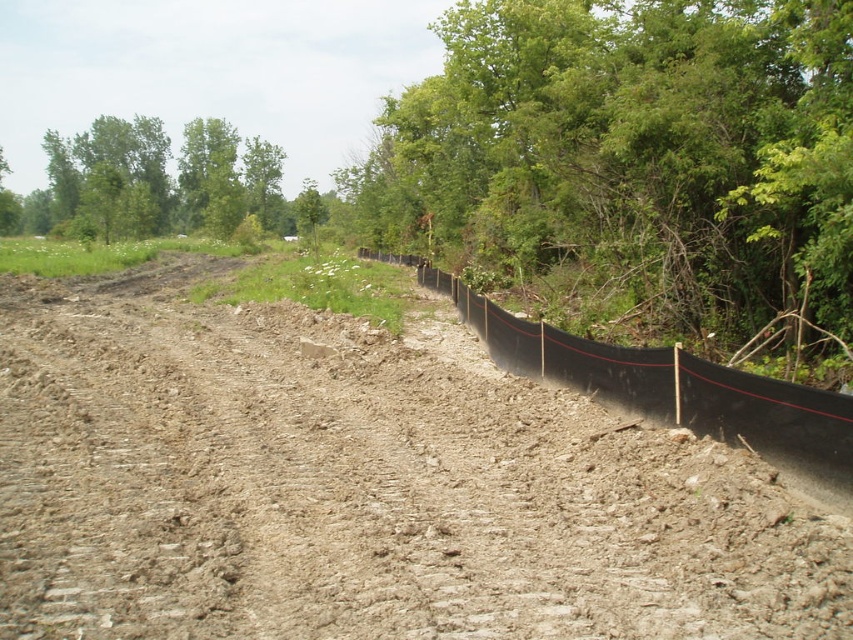
You are a construction worker assessing the site. You notice the brown soil at center and the green leafy tree at right. Which object is positioned lower in the scene?

The brown soil at center is located below the green leafy tree at right, so it is positioned lower in the scene.

You are a construction worker tasked with placing a new piece of equipment in the area shown. The equipment requires a space larger than the black plastic fence at right. Based on the scene, can the brown soil at center accommodate this equipment?

The brown soil at center is bigger than the black plastic fence at right, so yes, the equipment can be placed there as it has sufficient space.